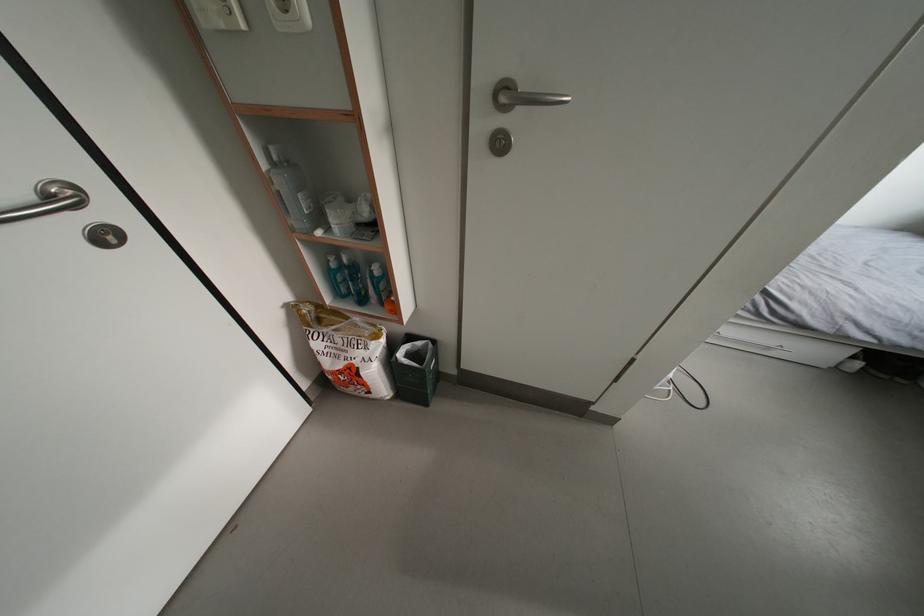
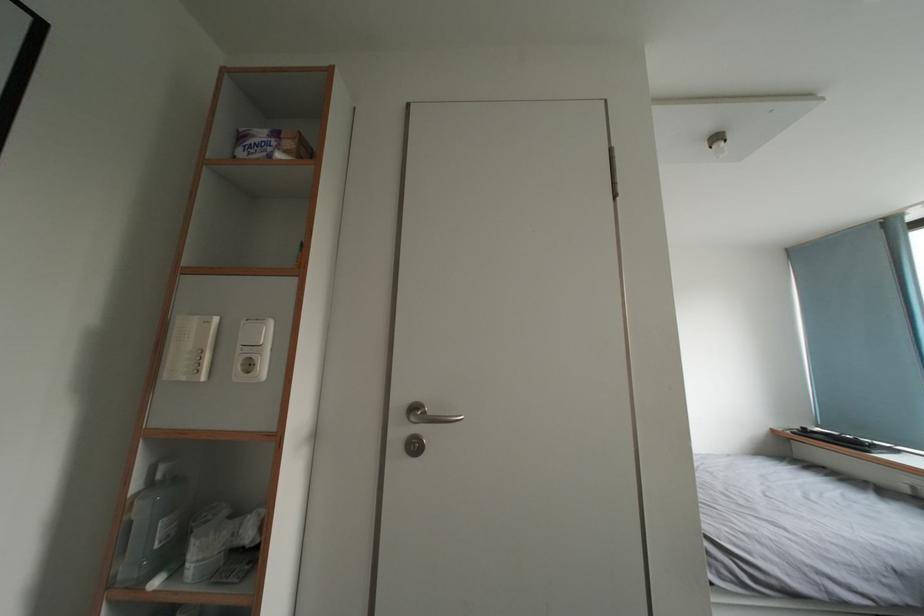
The images are taken continuously from a first-person perspective. In which direction is your viewpoint rotating?

The camera rotated toward right-up.